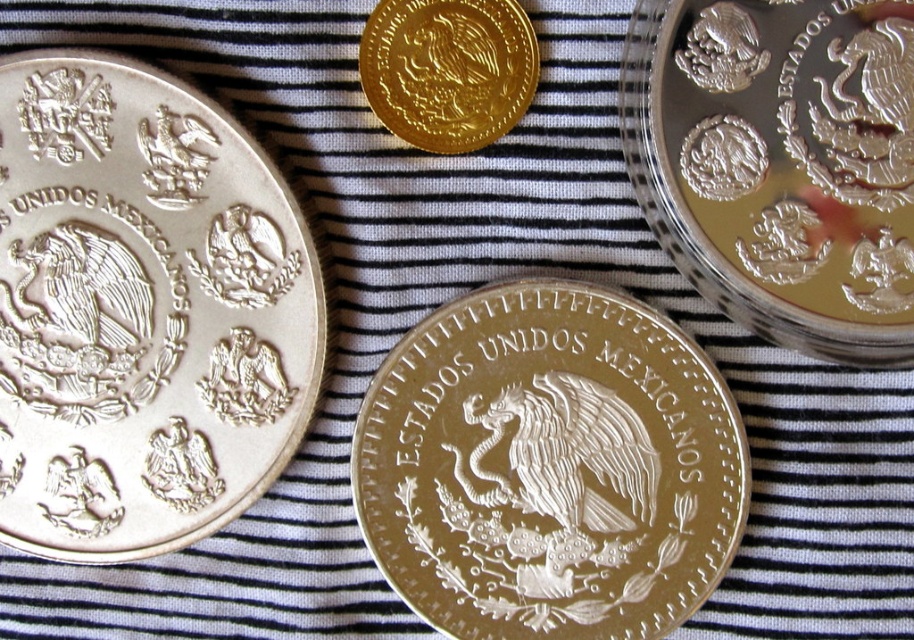
Question: Which of these objects is positioned farthest from the silver/metallic coin at left?

Choices:
 (A) silver/golden metallic coin at upper right
 (B) gold shiny coin at upper center

Answer: (A)

Question: Which point is closer to the camera taking this photo?

Choices:
 (A) (537, 74)
 (B) (402, 340)

Answer: (A)

Question: Is gold shiny coin at upper center bigger than satin gold eagle at center?

Choices:
 (A) yes
 (B) no

Answer: (B)

Question: Is silver/golden metallic coin at upper right bigger than satin gold eagle at center?

Choices:
 (A) no
 (B) yes

Answer: (B)

Question: Which of the following is the closest to the observer?

Choices:
 (A) silver/metallic coin at left
 (B) satin gold eagle at center
 (C) silver/golden metallic coin at upper right

Answer: (C)

Question: Can you confirm if gold shiny coin at upper center is thinner than satin gold eagle at center?

Choices:
 (A) no
 (B) yes

Answer: (B)